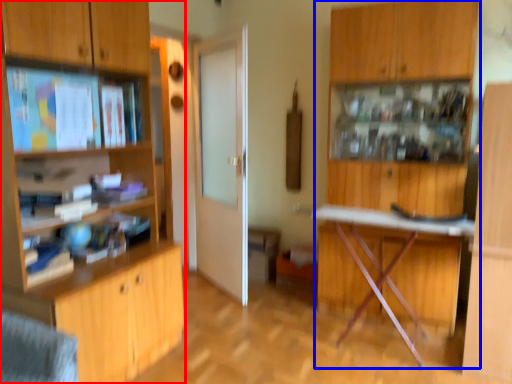
Question: Which point is closer to the camera, cabinetry (highlighted by a red box) or dresser (highlighted by a blue box)?

Choices:
 (A) cabinetry
 (B) dresser

Answer: (A)